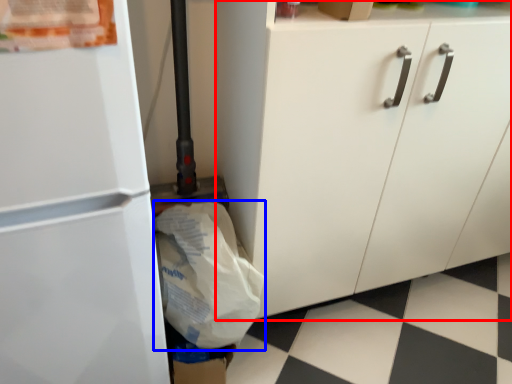
Question: Which object is further to the camera taking this photo, cabinetry (highlighted by a red box) or grocery bag (highlighted by a blue box)?

Choices:
 (A) cabinetry
 (B) grocery bag

Answer: (B)